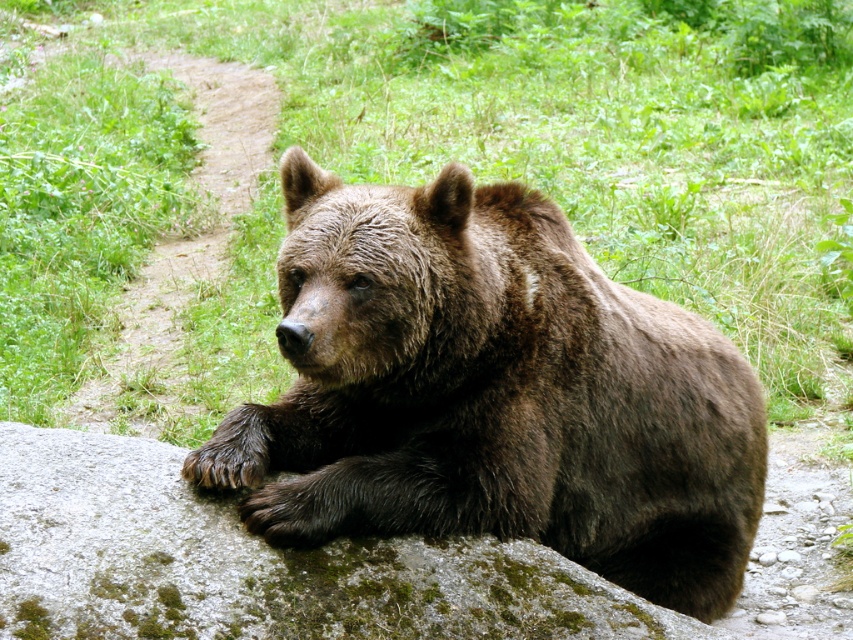
Question: Does brown furry bear at center appear under green mossy rock at center?

Choices:
 (A) yes
 (B) no

Answer: (B)

Question: Does brown furry bear at center appear under green mossy rock at center?

Choices:
 (A) yes
 (B) no

Answer: (B)

Question: Can you confirm if brown furry bear at center is wider than green mossy rock at center?

Choices:
 (A) yes
 (B) no

Answer: (B)

Question: Which point is farther from the camera taking this photo?

Choices:
 (A) (457, 296)
 (B) (270, 552)

Answer: (A)